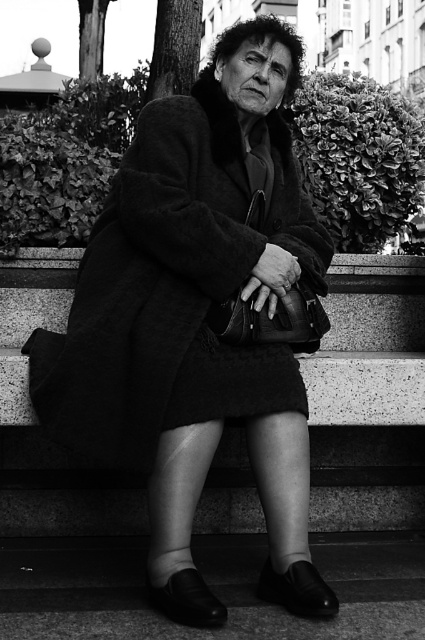
Question: Can you confirm if fuzzy wool coat at center is bigger than granite steps at center?

Choices:
 (A) yes
 (B) no

Answer: (A)

Question: Which object is farther from the camera taking this photo?

Choices:
 (A) fuzzy wool coat at center
 (B) granite steps at center

Answer: (A)

Question: Observing the image, what is the correct spatial positioning of fuzzy wool coat at center in reference to granite steps at center?

Choices:
 (A) left
 (B) right

Answer: (B)

Question: Which of the following is the farthest from the observer?

Choices:
 (A) granite steps at center
 (B) fuzzy wool coat at center

Answer: (B)

Question: Which of the following is the farthest from the observer?

Choices:
 (A) fuzzy wool coat at center
 (B) granite steps at center

Answer: (A)

Question: Is fuzzy wool coat at center positioned in front of granite steps at center?

Choices:
 (A) no
 (B) yes

Answer: (A)